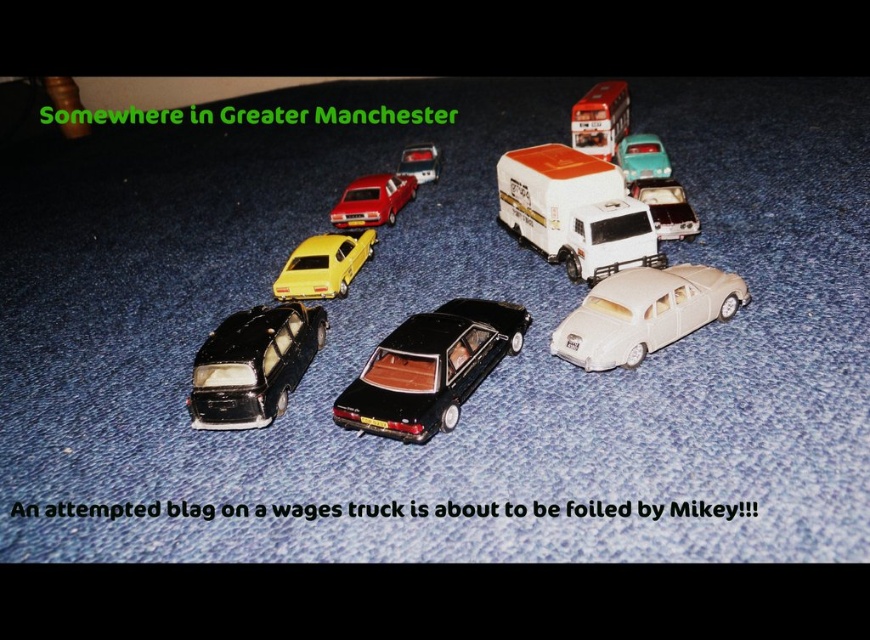
You are a detective examining the scene of a miniature toy car crime. You notice a white glossy truck at center and a matte red car at center. Which object is closer to you, the observer?

The white glossy truck at center is closer to you because it is in front of the matte red car at center.

You are a character in the scene and need to quickly move from the matte red car at center to the white glossy truck at center. Which direction should you move in?

You should move to the right to reach the white glossy truck at center from the matte red car at center, as the white glossy truck at center is positioned to the right of the matte red car at center.

You are a toy collector who wants to place a new toy motorcycle between the metallic silver bus at upper right and the matte teal car at upper right. Based on their current positions, which toy should you move to make space?

The metallic silver bus at upper right is positioned on the left side of matte teal car at upper right. To make space for the motorcycle, you should move the metallic silver bus at upper right to the left or the matte teal car at upper right to the right.